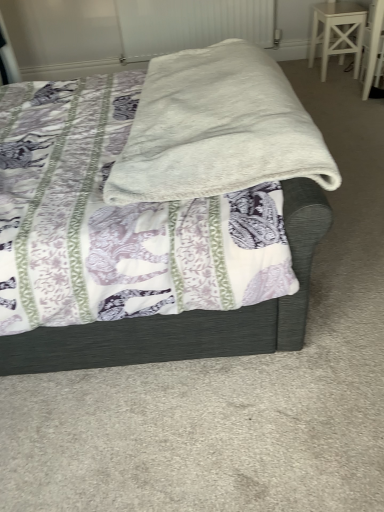
Question: Is white painted wood stool at upper right at the left side of white textured radiator at upper center?

Choices:
 (A) no
 (B) yes

Answer: (A)

Question: Can you confirm if white painted wood stool at upper right is thinner than white textured radiator at upper center?

Choices:
 (A) yes
 (B) no

Answer: (B)

Question: From the image's perspective, does white painted wood stool at upper right appear lower than white textured radiator at upper center?

Choices:
 (A) no
 (B) yes

Answer: (B)

Question: Is white painted wood stool at upper right turned away from white textured radiator at upper center?

Choices:
 (A) no
 (B) yes

Answer: (B)

Question: Can white textured radiator at upper center be found inside white painted wood stool at upper right?

Choices:
 (A) yes
 (B) no

Answer: (B)

Question: Can you confirm if white painted wood stool at upper right is bigger than white textured radiator at upper center?

Choices:
 (A) yes
 (B) no

Answer: (B)

Question: From the image's perspective, is white soft blanket at center beneath white textured radiator at upper center?

Choices:
 (A) yes
 (B) no

Answer: (A)

Question: Is white soft blanket at center facing away from white textured radiator at upper center?

Choices:
 (A) yes
 (B) no

Answer: (B)

Question: Is white soft blanket at center thinner than white textured radiator at upper center?

Choices:
 (A) yes
 (B) no

Answer: (B)

Question: Considering the relative sizes of white soft blanket at center and white textured radiator at upper center in the image provided, is white soft blanket at center taller than white textured radiator at upper center?

Choices:
 (A) yes
 (B) no

Answer: (A)

Question: Is white soft blanket at center at the right side of white textured radiator at upper center?

Choices:
 (A) no
 (B) yes

Answer: (A)

Question: From the image's perspective, is white soft blanket at center on white textured radiator at upper center?

Choices:
 (A) no
 (B) yes

Answer: (A)

Question: From a real-world perspective, is white textured radiator at upper center on white soft blanket at center?

Choices:
 (A) no
 (B) yes

Answer: (A)